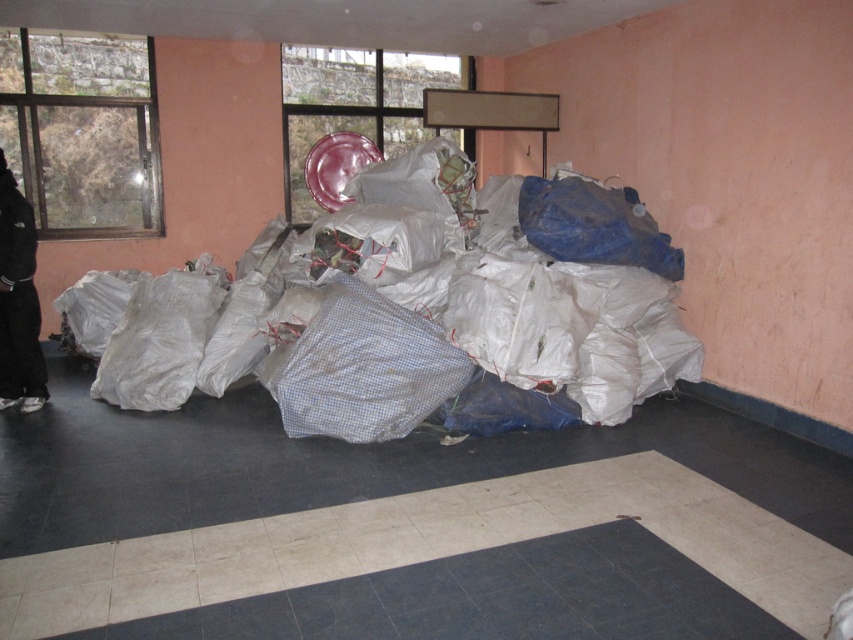
You are standing in the room depicted in the scene. There is a point marked at coordinates (415, 316). What object is located at that point?

Result: The point at coordinates (415, 316) corresponds to the white plastic bags at center.

You are organizing items in a storage room. You need to place the white plastic bags at center and the black fabric pants at left. Which object takes up more space in the room?

The white plastic bags at center takes up more space in the room because it is bigger than the black fabric pants at left.